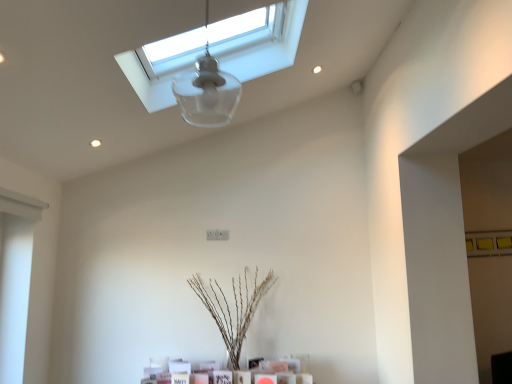
Question: In terms of size, does brown textured plant at center appear bigger or smaller than transparent glass window at upper center?

Choices:
 (A) small
 (B) big

Answer: (A)

Question: From the image's perspective, is brown textured plant at center positioned above or below transparent glass window at upper center?

Choices:
 (A) above
 (B) below

Answer: (B)

Question: Which of these objects is positioned closest to the transparent glass window at upper center?

Choices:
 (A) brown textured plant at center
 (B) transparent glass lampshade at upper center

Answer: (B)

Question: Considering the real-world distances, which object is closest to the transparent glass lampshade at upper center?

Choices:
 (A) brown textured plant at center
 (B) transparent glass window at upper center

Answer: (B)